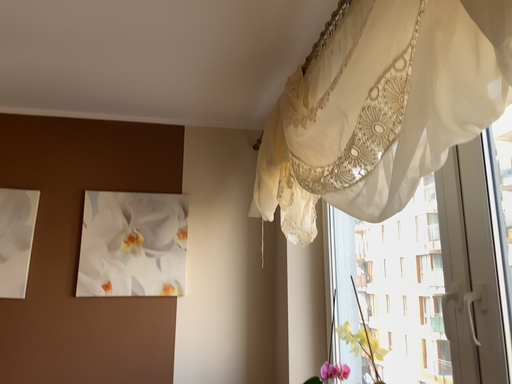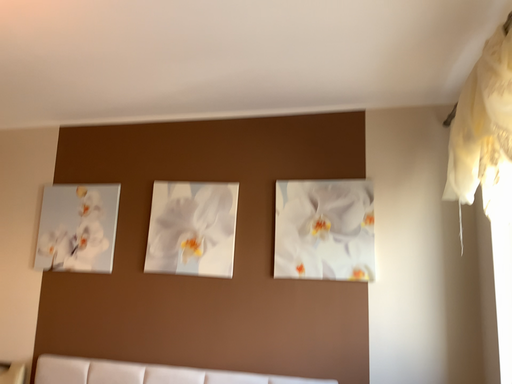
Question: Which way did the camera rotate in the video?

Choices:
 (A) rotated left
 (B) rotated right

Answer: (A)